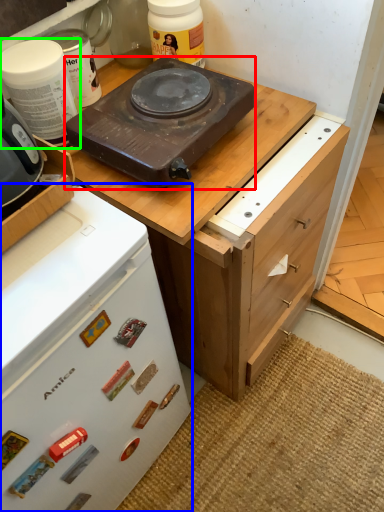
Question: Which object is the closest to the kitchen appliance (highlighted by a red box)? Choose among these: home appliance (highlighted by a blue box) or kitchen appliance (highlighted by a green box).

Choices:
 (A) home appliance
 (B) kitchen appliance

Answer: (B)